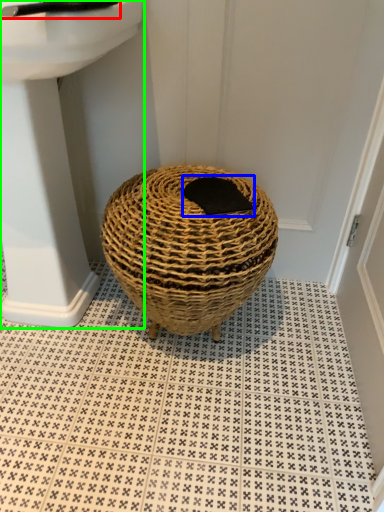
Question: Which object is the farthest from faucet (highlighted by a red box)? Choose among these: pad (highlighted by a blue box) or sink (highlighted by a green box).

Choices:
 (A) pad
 (B) sink

Answer: (A)